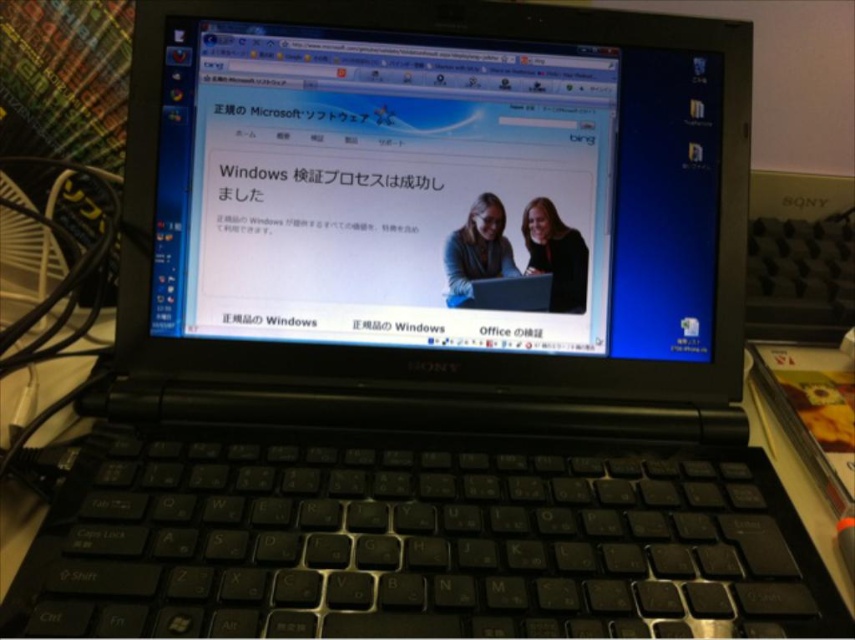
Question: Is the position of matte black laptop at center more distant than that of black matte keyboard at center?

Choices:
 (A) no
 (B) yes

Answer: (B)

Question: Which of the following is the closest to the observer?

Choices:
 (A) 397,67
 (B) 420,529

Answer: (B)

Question: Does matte black laptop at center have a larger size compared to black matte keyboard at center?

Choices:
 (A) no
 (B) yes

Answer: (A)

Question: Can you confirm if matte black laptop at center is positioned above black matte keyboard at center?

Choices:
 (A) yes
 (B) no

Answer: (A)

Question: Which object is farther from the camera taking this photo?

Choices:
 (A) matte black laptop at center
 (B) black matte keyboard at center

Answer: (A)